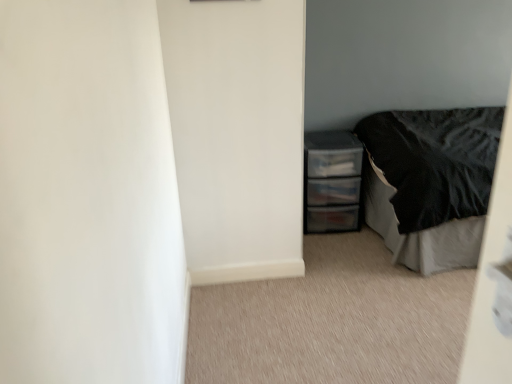
Question: Considering the relative positions of black satin bed at right and clear plastic drawers at right in the image provided, is black satin bed at right to the left or to the right of clear plastic drawers at right?

Choices:
 (A) right
 (B) left

Answer: (A)

Question: In terms of height, does black satin bed at right look taller or shorter compared to clear plastic drawers at right?

Choices:
 (A) tall
 (B) short

Answer: (A)

Question: From a real-world perspective, is black satin bed at right physically located above or below clear plastic drawers at right?

Choices:
 (A) above
 (B) below

Answer: (A)

Question: From their relative heights in the image, would you say clear plastic drawers at right is taller or shorter than black satin bed at right?

Choices:
 (A) tall
 (B) short

Answer: (B)

Question: Is clear plastic drawers at right spatially inside black satin bed at right, or outside of it?

Choices:
 (A) inside
 (B) outside

Answer: (B)

Question: Is clear plastic drawers at right in front of or behind black satin bed at right in the image?

Choices:
 (A) behind
 (B) front

Answer: (A)

Question: In terms of width, does clear plastic drawers at right look wider or thinner when compared to black satin bed at right?

Choices:
 (A) thin
 (B) wide

Answer: (A)